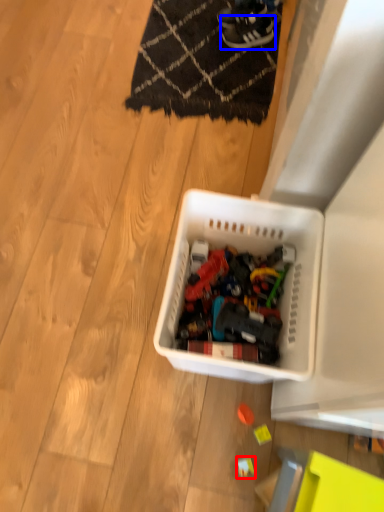
Question: Among these objects, which one is farthest to the camera, toy (highlighted by a red box) or footwear (highlighted by a blue box)?

Choices:
 (A) toy
 (B) footwear

Answer: (B)